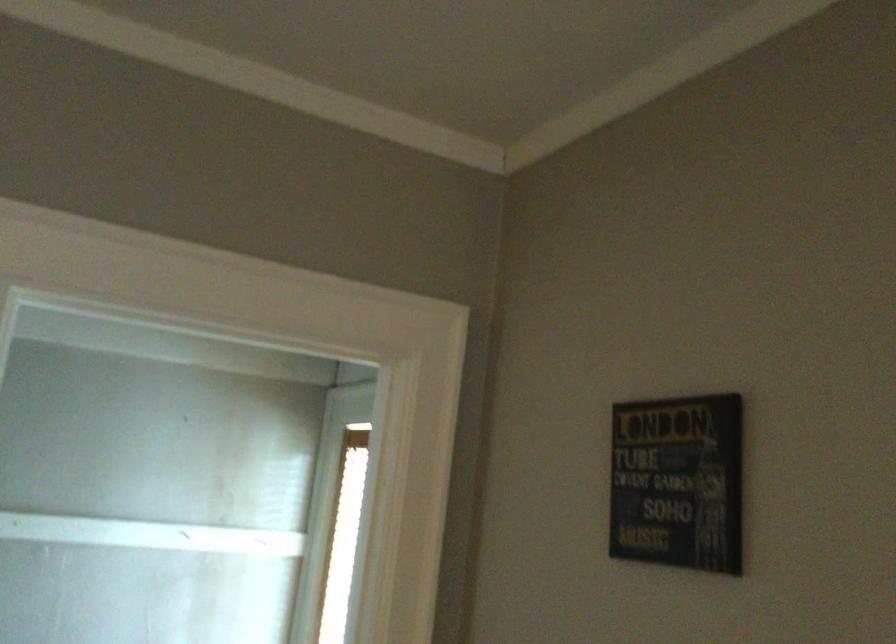
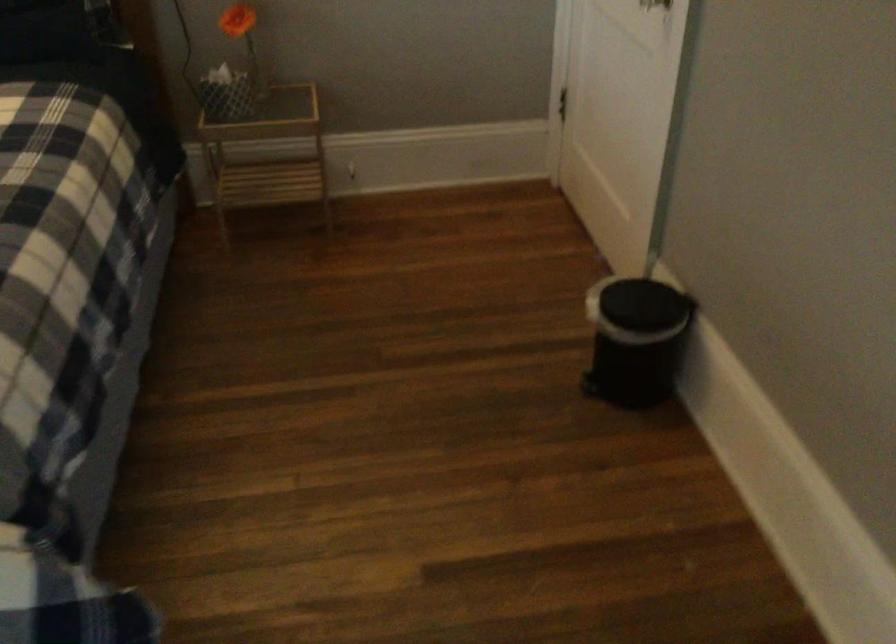
First-person continuous shooting, in which direction is the camera rotating?

The rotation direction of the camera is left-down.